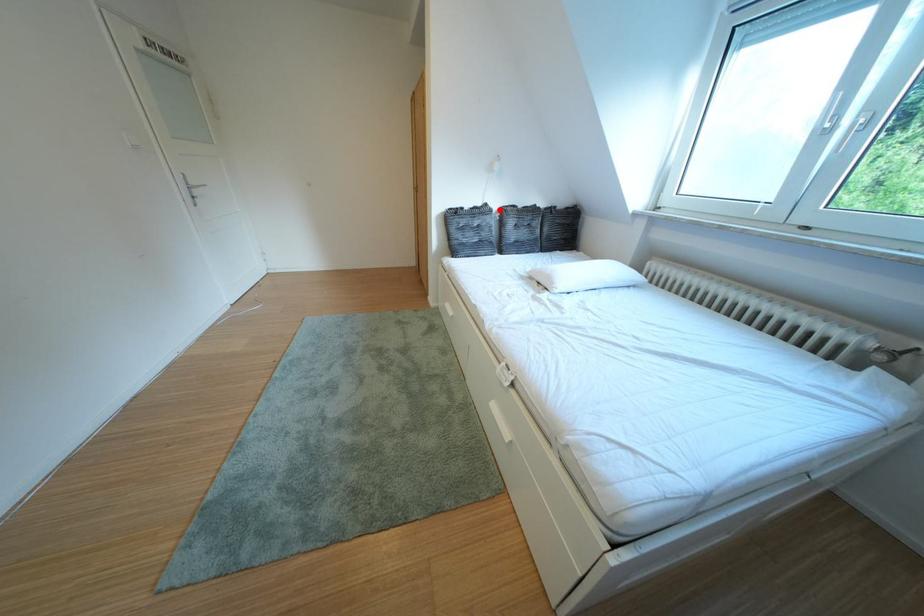
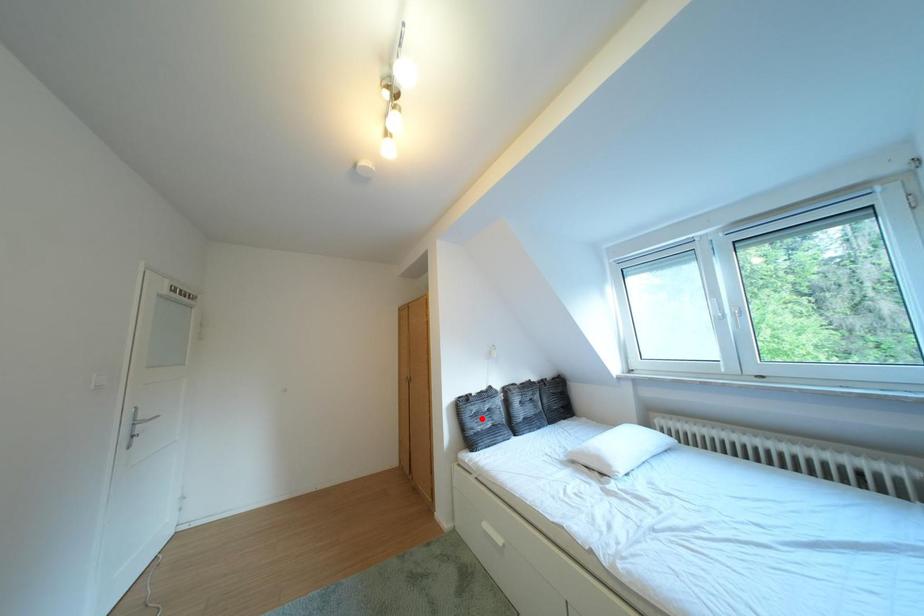
I am providing you with two images of the same scene from different viewpoints. A red point is marked on the first image and another point is marked on the second image. Does the point marked in image1 correspond to the same location as the one in image2?

No